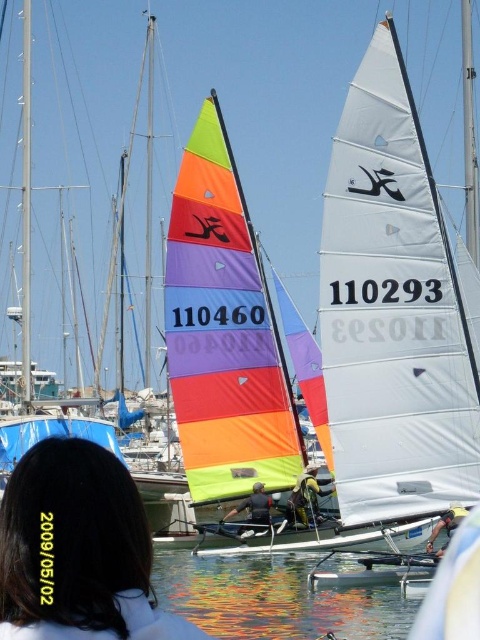
Can you confirm if dark brown hair at center is bigger than camouflage fabric jacket at center?

Correct, dark brown hair at center is larger in size than camouflage fabric jacket at center.

Is dark brown hair at center in front of camouflage fabric jacket at center?

Yes, it is in front of camouflage fabric jacket at center.

Between point (99, 557) and point (296, 516), which one is positioned behind?

The point (296, 516) is more distant.

Where is `dark brown hair at center`? The width and height of the screenshot is (480, 640). dark brown hair at center is located at coordinates (78, 550).

Between point (322, 600) and point (250, 513), which one is positioned in front?

Positioned in front is point (322, 600).

Describe the element at coordinates (273, 600) in the screenshot. This screenshot has width=480, height=640. I see `reflective water at lower center` at that location.

Measure the distance between point [369,596] and camera.

They are 67.47 meters apart.

Where is `reflective water at lower center`? The width and height of the screenshot is (480, 640). reflective water at lower center is located at coordinates (273, 600).

Which is above, camouflage fabric jacket at center or metallic silver helmet at center?

metallic silver helmet at center

I want to click on camouflage fabric jacket at center, so click(x=307, y=497).

Locate an element on the screen. camouflage fabric jacket at center is located at coordinates (307, 497).